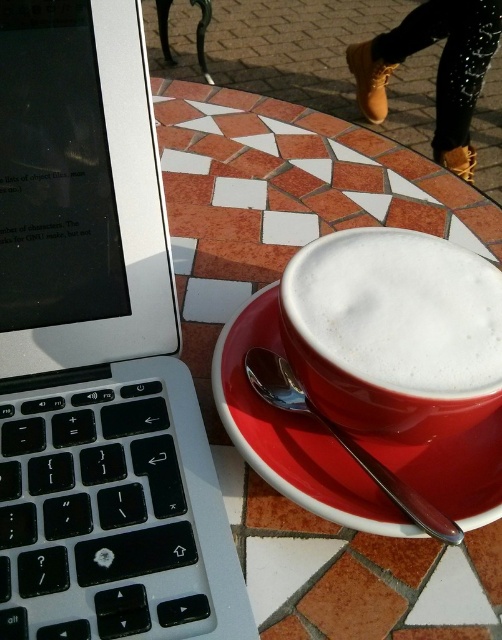
Between silver metallic laptop at left and white frothy foam at center, which one is positioned higher?

white frothy foam at center

Can you confirm if silver metallic laptop at left is positioned to the left of white frothy foam at center?

Yes, silver metallic laptop at left is to the left of white frothy foam at center.

Measure the distance between point (225, 592) and camera.

They are 23.18 centimeters apart.

This screenshot has height=640, width=502. What are the coordinates of `silver metallic laptop at left` in the screenshot? It's located at (96, 353).

Between point (450, 339) and point (274, 307), which one is positioned in front?

Point (450, 339) is in front.

Does point (465, 273) lie in front of point (269, 426)?

Yes, it is in front of point (269, 426).

I want to click on white frothy foam at center, so click(x=400, y=310).

Between silver metallic laptop at left and red ceramic saucer at center, which one appears on the left side from the viewer's perspective?

Positioned to the left is silver metallic laptop at left.

How much distance is there between silver metallic laptop at left and red ceramic saucer at center?

A distance of 6.94 centimeters exists between silver metallic laptop at left and red ceramic saucer at center.

Is point (3, 547) closer to camera compared to point (312, 461)?

Yes, it is.

Where is `silver metallic laptop at left`? silver metallic laptop at left is located at coordinates (96, 353).